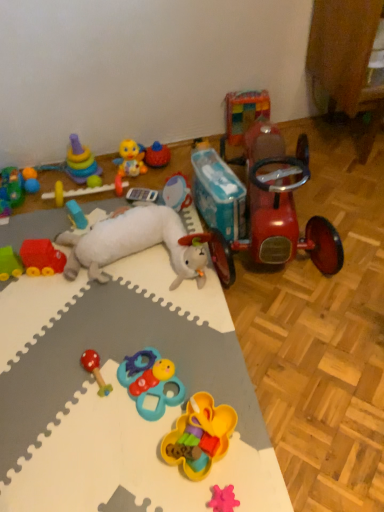
The width and height of the screenshot is (384, 512). In order to click on empty space that is in between blue rubber rattle at center, the sixth toy positioned from the right, and white plush toy at center, the 7th toy in the right-to-left sequence in this screenshot , I will do `click(145, 324)`.